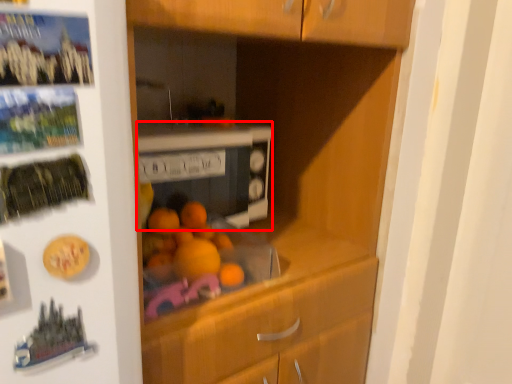
Question: From the image's perspective, where is home appliance (annotated by the red box) located relative to button?

Choices:
 (A) above
 (B) below

Answer: (B)